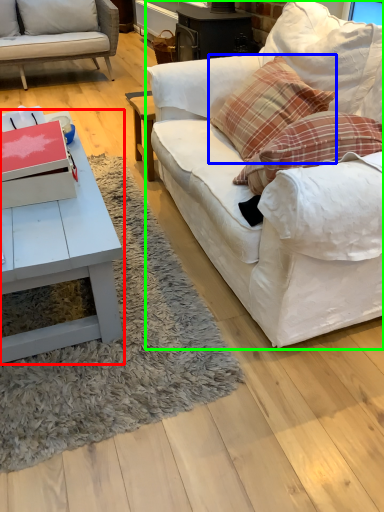
Question: Which object is the closest to the coffee table (highlighted by a red box)? Choose among these: pillow (highlighted by a blue box) or studio couch (highlighted by a green box).

Choices:
 (A) pillow
 (B) studio couch

Answer: (B)